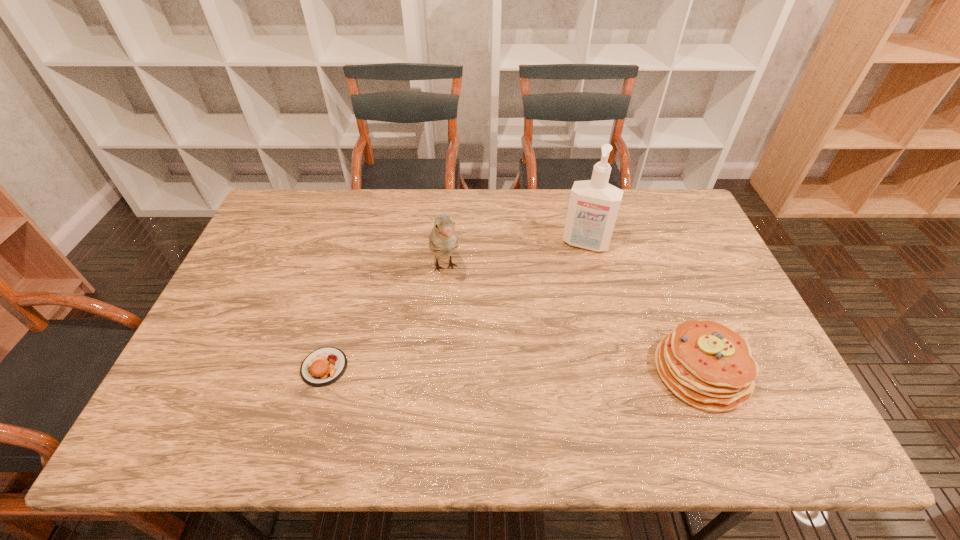
Identify the location of the shortest object. point(324,366).

I want to click on patty (food), so click(324, 366).

Locate an element on the screen. The image size is (960, 540). pancake is located at coordinates (707, 365).

Locate an element on the screen. This screenshot has height=540, width=960. the third tallest object is located at coordinates (707, 365).

Image resolution: width=960 pixels, height=540 pixels. I want to click on the tallest object, so click(593, 207).

The width and height of the screenshot is (960, 540). I want to click on the third object from left to right, so click(x=593, y=207).

The height and width of the screenshot is (540, 960). Identify the location of the third shortest object. (442, 241).

Image resolution: width=960 pixels, height=540 pixels. Find the location of `bird`. bird is located at coordinates (442, 241).

Where is `free space located on the right of the shortest object`? free space located on the right of the shortest object is located at coordinates (404, 367).

At what (x,y) coordinates should I click in order to perform the action: click on vacant area situated 0.110m on the left of the rightmost object. Please return your answer as a coordinate pair (x, y). The image size is (960, 540). Looking at the image, I should click on (610, 371).